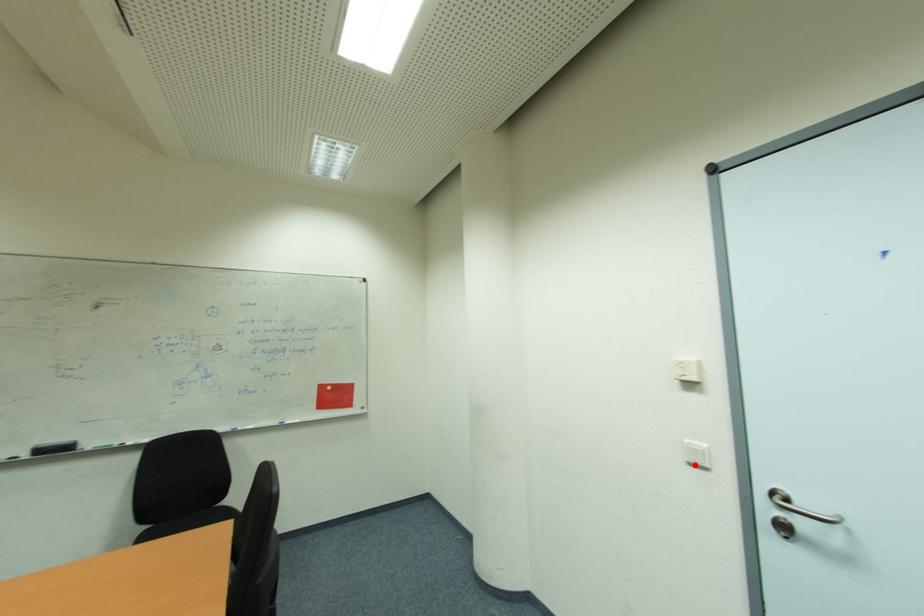
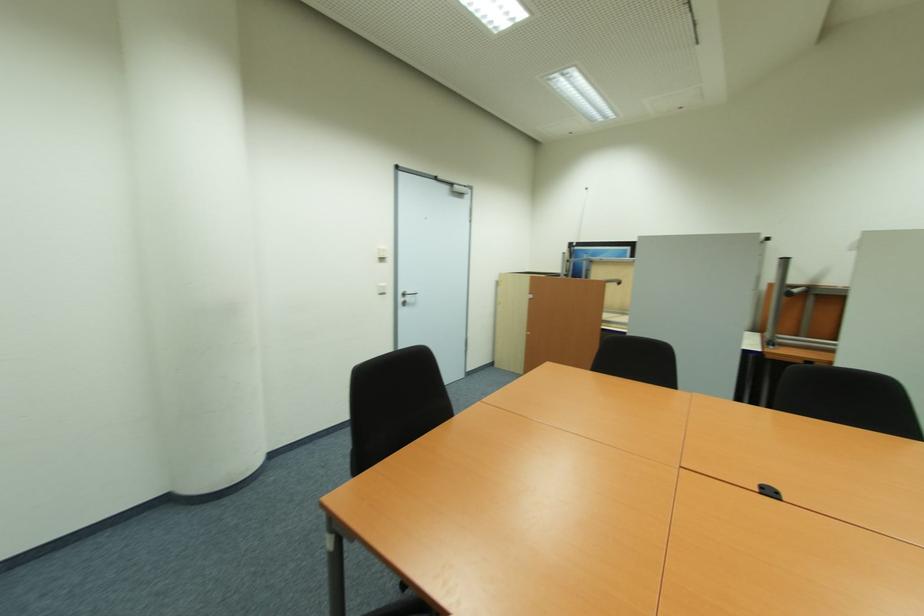
In the second image, find the point that corresponds to the highlighted location in the first image.

(383, 294)